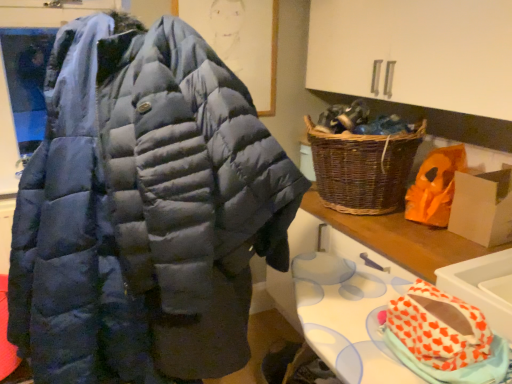
Question: Based on their positions, is navy blue puffer jacket at center located to the left or right of orange heart-patterned fabric at lower right?

Choices:
 (A) right
 (B) left

Answer: (B)

Question: Would you say navy blue puffer jacket at center is inside or outside orange heart-patterned fabric at lower right?

Choices:
 (A) inside
 (B) outside

Answer: (B)

Question: Which object is positioned farthest from the navy blue puffer jacket at center?

Choices:
 (A) orange paper bag at right
 (B) orange heart-patterned fabric at lower right
 (C) woven brown picnic basket at right
 (D) white glossy sink at lower right
 (E) white cardboard box at right

Answer: (E)

Question: Considering the real-world distances, which object is farthest from the orange heart-patterned fabric at lower right?

Choices:
 (A) navy blue puffer jacket at center
 (B) orange paper bag at right
 (C) white cardboard box at right
 (D) woven brown picnic basket at right
 (E) white glossy sink at lower right

Answer: (D)